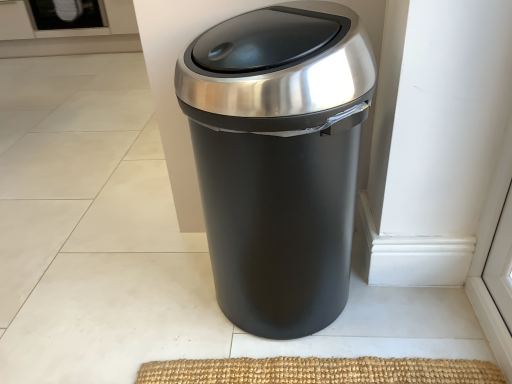
Where is `black glass screen door at upper left`? black glass screen door at upper left is located at coordinates (67, 14).

What do you see at coordinates (67, 14) in the screenshot? The height and width of the screenshot is (384, 512). I see `black glass screen door at upper left` at bounding box center [67, 14].

This screenshot has height=384, width=512. I want to click on matte black trash can at center, so click(279, 159).

Image resolution: width=512 pixels, height=384 pixels. Describe the element at coordinates (279, 159) in the screenshot. I see `matte black trash can at center` at that location.

Measure the distance between matte black trash can at center and camera.

matte black trash can at center is 26.31 inches away from camera.

Image resolution: width=512 pixels, height=384 pixels. Identify the location of black glass screen door at upper left. (67, 14).

Is black glass screen door at upper left to the left or to the right of matte black trash can at center in the image?

black glass screen door at upper left is positioned on matte black trash can at center's left side.

In the image, is black glass screen door at upper left positioned in front of or behind matte black trash can at center?

black glass screen door at upper left is behind matte black trash can at center.

Is point (35, 10) closer or farther from the camera than point (240, 278)?

Point (35, 10) is farther from the camera than point (240, 278).

From the image's perspective, does black glass screen door at upper left appear higher than matte black trash can at center?

Yes.

From a real-world perspective, does black glass screen door at upper left stand above matte black trash can at center?

Actually, black glass screen door at upper left is physically below matte black trash can at center in the real world.

Which of these two, black glass screen door at upper left or matte black trash can at center, is wider?

black glass screen door at upper left.

Considering the relative sizes of black glass screen door at upper left and matte black trash can at center in the image provided, is black glass screen door at upper left taller than matte black trash can at center?

In fact, black glass screen door at upper left may be shorter than matte black trash can at center.

Which of these two, black glass screen door at upper left or matte black trash can at center, is bigger?

Bigger between the two is matte black trash can at center.

Is matte black trash can at center a part of black glass screen door at upper left?

No, black glass screen door at upper left does not contain matte black trash can at center.

Looking at this image, is black glass screen door at upper left touching matte black trash can at center?

No.

Does black glass screen door at upper left turn towards matte black trash can at center?

No.

What's the angular difference between black glass screen door at upper left and matte black trash can at center's facing directions?

black glass screen door at upper left and matte black trash can at center are facing 89.2 degrees away from each other.

I want to click on screen door located on the left of matte black trash can at center, so click(x=67, y=14).

Visually, is matte black trash can at center positioned to the left or to the right of black glass screen door at upper left?

Based on their positions, matte black trash can at center is located to the right of black glass screen door at upper left.

Is matte black trash can at center positioned before black glass screen door at upper left?

Yes, the depth of matte black trash can at center is less than that of black glass screen door at upper left.

Considering the positions of points (273, 88) and (59, 13), is point (273, 88) closer to camera compared to point (59, 13)?

Yes, it is in front of point (59, 13).

From the image's perspective, does matte black trash can at center appear higher than black glass screen door at upper left?

Incorrect, from the image's perspective, matte black trash can at center is lower than black glass screen door at upper left.

From a real-world perspective, is matte black trash can at center located higher than black glass screen door at upper left?

Yes, from a real-world perspective, matte black trash can at center is over black glass screen door at upper left

Can you confirm if matte black trash can at center is wider than black glass screen door at upper left?

Incorrect, the width of matte black trash can at center does not surpass that of black glass screen door at upper left.

Considering the sizes of objects matte black trash can at center and black glass screen door at upper left in the image provided, who is shorter, matte black trash can at center or black glass screen door at upper left?

black glass screen door at upper left is shorter.

Does matte black trash can at center have a smaller size compared to black glass screen door at upper left?

Incorrect, matte black trash can at center is not smaller in size than black glass screen door at upper left.

Is matte black trash can at center inside the boundaries of black glass screen door at upper left, or outside?

matte black trash can at center is not inside black glass screen door at upper left, it's outside.

Is matte black trash can at center not close to black glass screen door at upper left?

matte black trash can at center is positioned a significant distance from black glass screen door at upper left.

Is matte black trash can at center aimed at black glass screen door at upper left?

No, matte black trash can at center does not turn towards black glass screen door at upper left.

Locate an element on the screen. Image resolution: width=512 pixels, height=384 pixels. waste container in front of the black glass screen door at upper left is located at coordinates (279, 159).

In order to click on screen door above the matte black trash can at center (from the image's perspective) in this screenshot , I will do `click(67, 14)`.

The height and width of the screenshot is (384, 512). I want to click on screen door behind the matte black trash can at center, so click(67, 14).